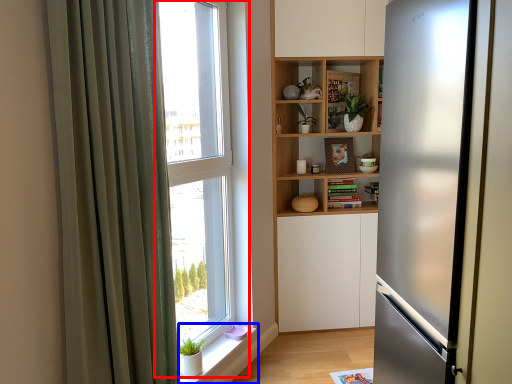
Question: Which object appears closest to the camera in this image, window (highlighted by a red box) or window sill (highlighted by a blue box)?

Choices:
 (A) window
 (B) window sill

Answer: (A)